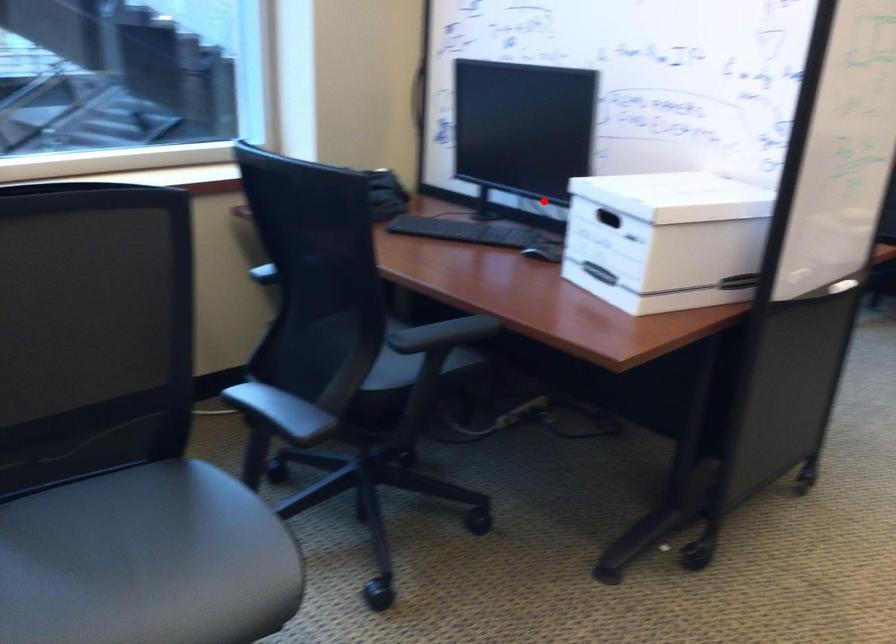
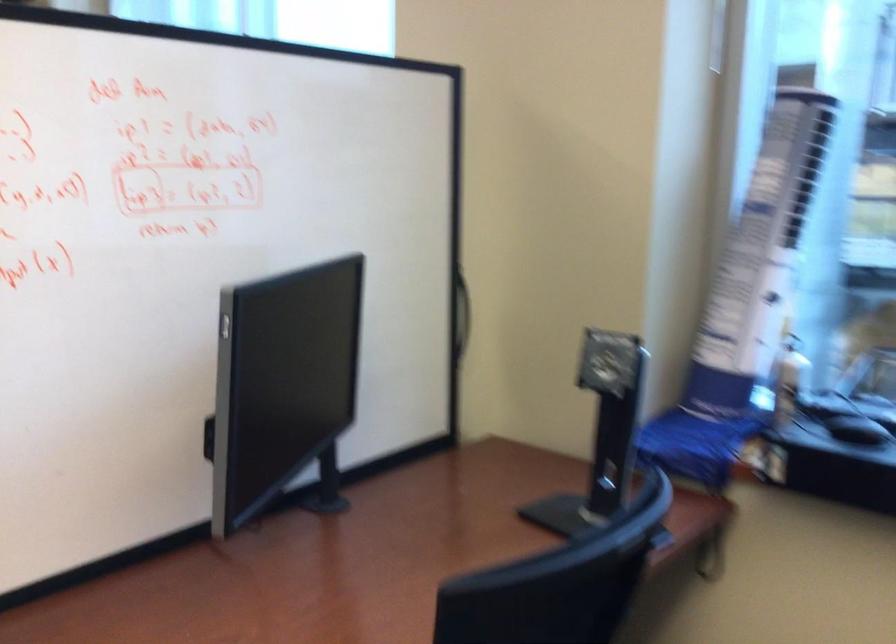
Find the pixel in the second image that matches the highlighted location in the first image.

(325, 487)